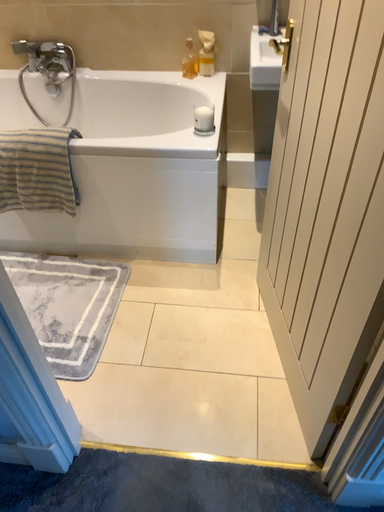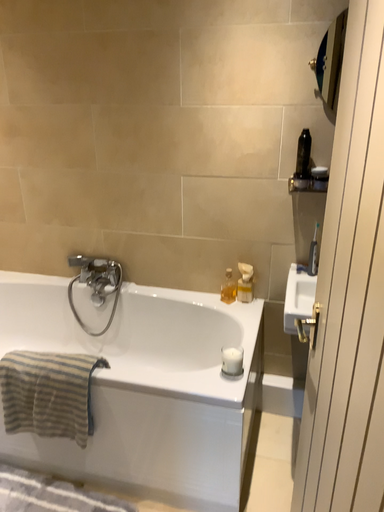
Question: Which way did the camera rotate in the video?

Choices:
 (A) rotated upward
 (B) rotated downward

Answer: (A)